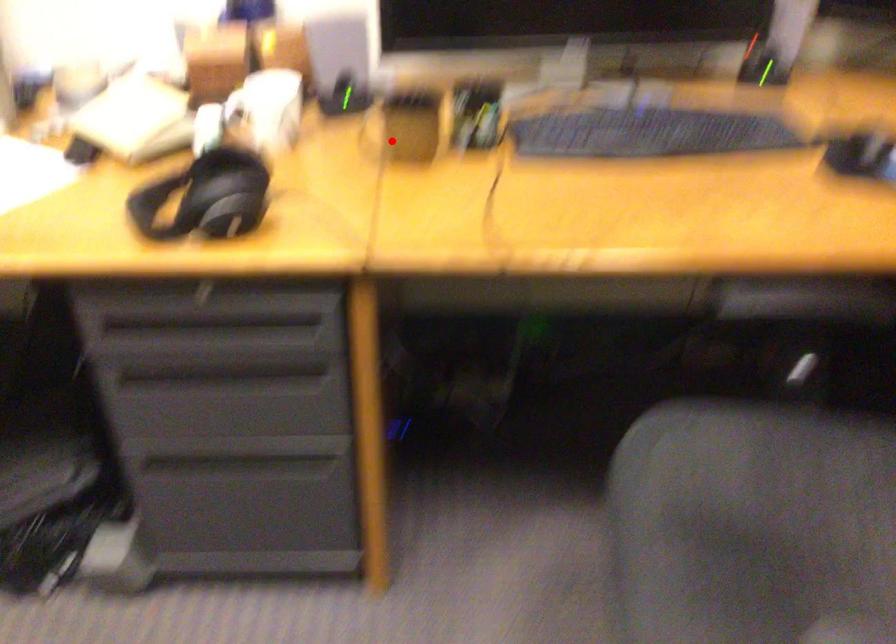
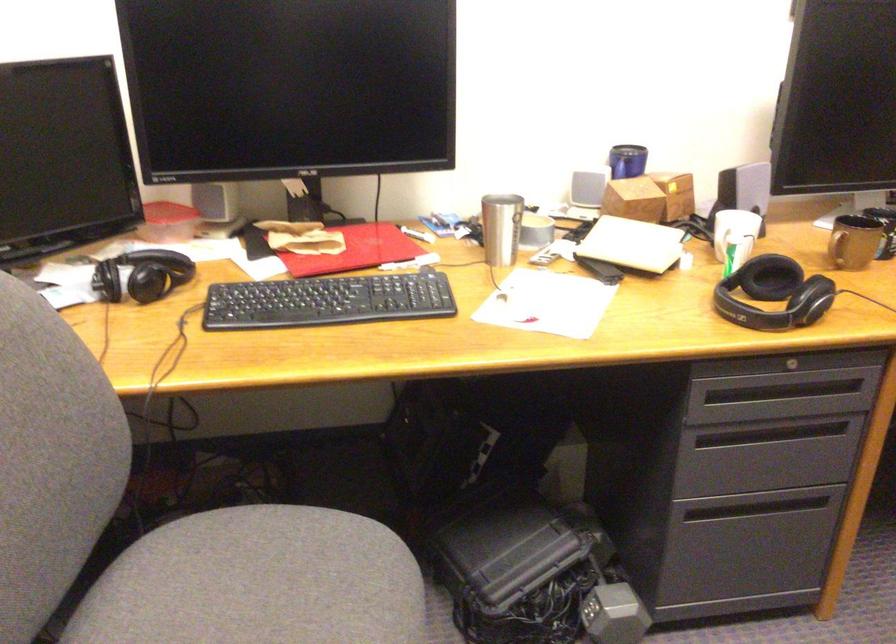
Question: I am providing you with two images of the same scene from different viewpoints. Image1 has a red point marked. In image2, the corresponding 3D location appears at what relative position? Reply with the corresponding letter.

Choices:
 (A) Closer
 (B) Farther

Answer: (B)